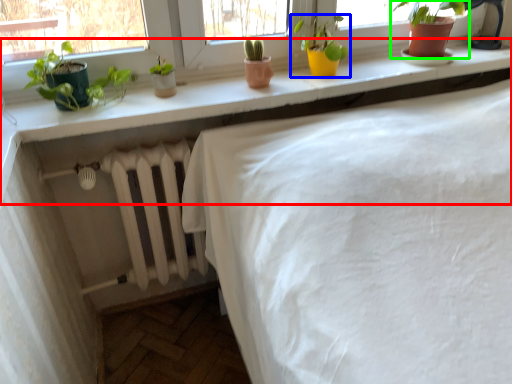
Question: Which is farther away from counter (highlighted by a red box)? houseplant (highlighted by a blue box) or houseplant (highlighted by a green box)?

Choices:
 (A) houseplant
 (B) houseplant

Answer: (B)